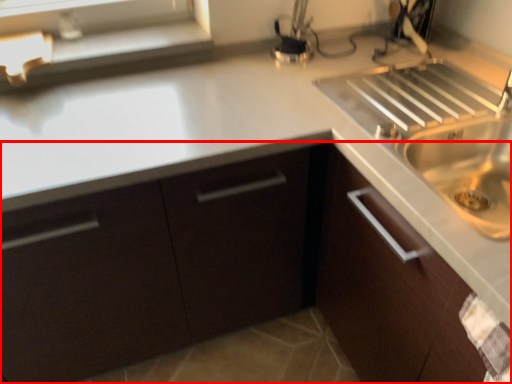
Question: From the image's perspective, considering the relative positions of cabinetry (annotated by the red box) and window sill in the image provided, where is cabinetry (annotated by the red box) located with respect to the staircase?

Choices:
 (A) below
 (B) above

Answer: (A)